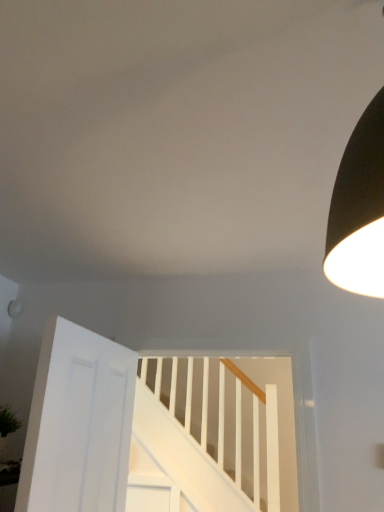
Question: In terms of size, does white matte door at lower left appear bigger or smaller than white wooden stairs at center?

Choices:
 (A) big
 (B) small

Answer: (B)

Question: Is white matte door at lower left taller or shorter than white wooden stairs at center?

Choices:
 (A) tall
 (B) short

Answer: (B)

Question: Is white matte door at lower left spatially inside white wooden stairs at center, or outside of it?

Choices:
 (A) inside
 (B) outside

Answer: (B)

Question: Is white wooden stairs at center inside the boundaries of white matte door at lower left, or outside?

Choices:
 (A) inside
 (B) outside

Answer: (B)

Question: In terms of size, does white wooden stairs at center appear bigger or smaller than white matte door at lower left?

Choices:
 (A) small
 (B) big

Answer: (B)

Question: From the image's perspective, is white wooden stairs at center above or below white matte door at lower left?

Choices:
 (A) above
 (B) below

Answer: (B)

Question: Is white wooden stairs at center wider or thinner than white matte door at lower left?

Choices:
 (A) thin
 (B) wide

Answer: (B)